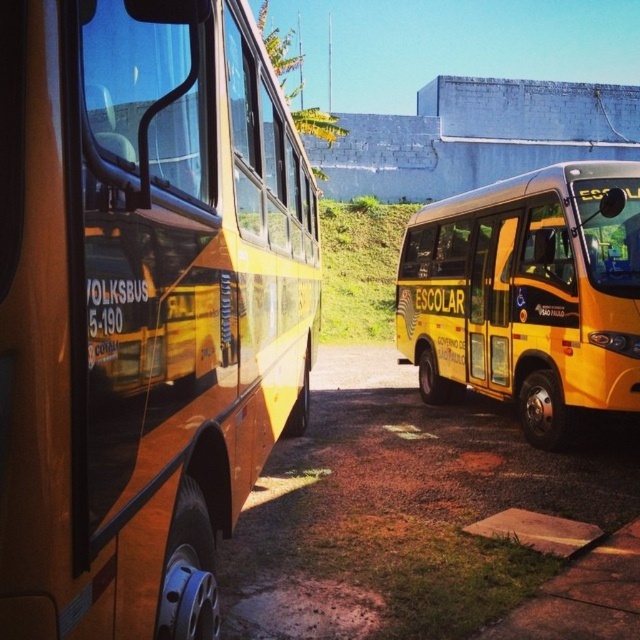
You are a delivery person who needs to park a small van between the two buses. The van requires 2 meters of space to fit. Based on the scene, can you determine if there is enough space between the yellow matte bus at center and the yellow matte bus at right to park your van?

The yellow matte bus at center occupies less space than yellow matte bus at right, but the description does not provide specific measurements of the space between them. Therefore, it is unclear if there is enough space to park the van.

You are standing 4 feet away from the yellow matte bus at center. Can you comfortably walk around it without moving closer than 3 feet to it?

The distance between you and the yellow matte bus at center is 3.93 feet, which is less than 4 feet. Therefore, you are already closer than 3 feet to it, so you cannot comfortably walk around without getting too close.